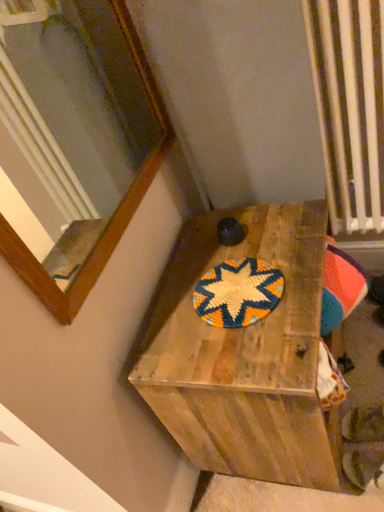
What are the coordinates of `empty space that is ontop of brightly woven mat at center (from a real-world perspective)` in the screenshot? It's located at (229, 287).